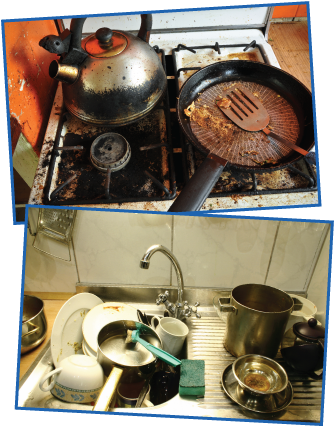
Generate point markers for all where you'd pick up the dirty frying pan to wash it in the image. Your answer should be formatted as a list of tuples, i.e. [(x1, y1), (x2, y2), ...], where each tuple contains the x and y coordinates of a point satisfying the conditions above.

[(193, 195)]